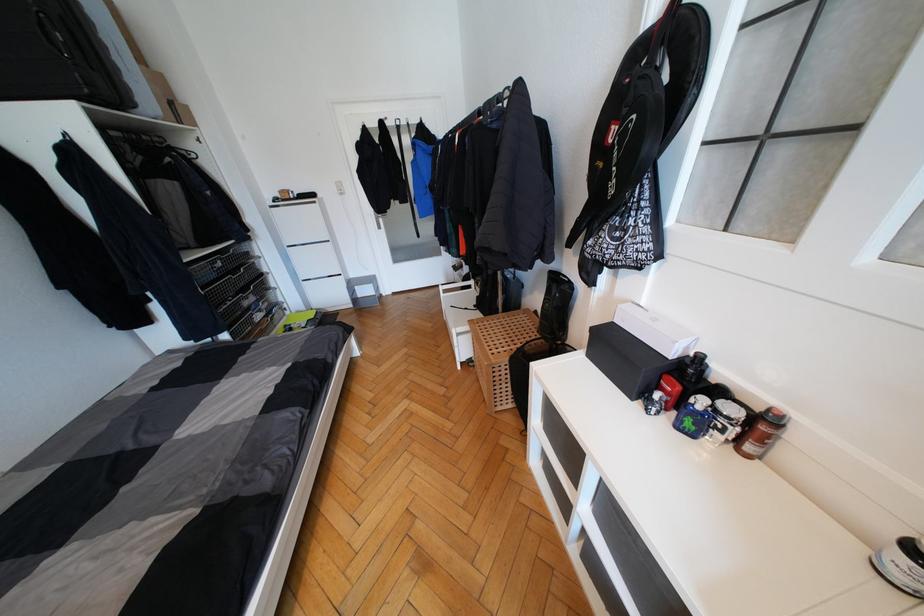
In order to click on wire drawer front in this screenshot , I will do `click(599, 525)`.